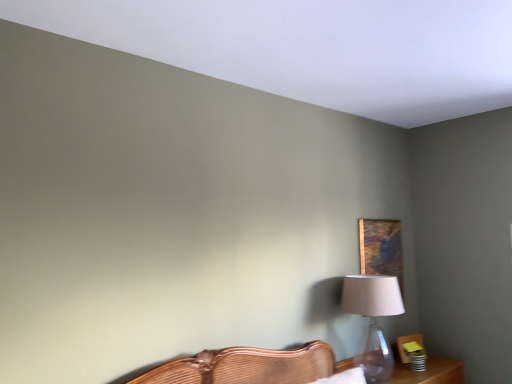
Question: Considering the relative positions of wooden table at lower right and translucent glass table lamp at right in the image provided, is wooden table at lower right to the right of translucent glass table lamp at right from the viewer's perspective?

Choices:
 (A) yes
 (B) no

Answer: (A)

Question: Is translucent glass table lamp at right at the back of wooden table at lower right?

Choices:
 (A) yes
 (B) no

Answer: (B)

Question: Is wooden table at lower right shorter than translucent glass table lamp at right?

Choices:
 (A) yes
 (B) no

Answer: (A)

Question: Is wooden table at lower right far away from translucent glass table lamp at right?

Choices:
 (A) yes
 (B) no

Answer: (B)

Question: Is wooden table at lower right beside translucent glass table lamp at right?

Choices:
 (A) no
 (B) yes

Answer: (A)

Question: Considering the relative sizes of wooden table at lower right and translucent glass table lamp at right in the image provided, is wooden table at lower right wider than translucent glass table lamp at right?

Choices:
 (A) no
 (B) yes

Answer: (B)

Question: Is wooden table at lower right inside translucent glass table lamp at right?

Choices:
 (A) yes
 (B) no

Answer: (B)

Question: Is the surface of translucent glass table lamp at right in direct contact with wooden table at lower right?

Choices:
 (A) yes
 (B) no

Answer: (B)

Question: Considering the relative sizes of translucent glass table lamp at right and wooden table at lower right in the image provided, is translucent glass table lamp at right wider than wooden table at lower right?

Choices:
 (A) yes
 (B) no

Answer: (B)

Question: From a real-world perspective, is translucent glass table lamp at right positioned over wooden table at lower right based on gravity?

Choices:
 (A) no
 (B) yes

Answer: (B)

Question: Considering the relative positions of translucent glass table lamp at right and wooden table at lower right in the image provided, is translucent glass table lamp at right behind wooden table at lower right?

Choices:
 (A) yes
 (B) no

Answer: (B)

Question: Is translucent glass table lamp at right looking in the opposite direction of wooden table at lower right?

Choices:
 (A) yes
 (B) no

Answer: (B)

Question: From a real-world perspective, is wooden table at lower right positioned over wooden painting at upper right based on gravity?

Choices:
 (A) yes
 (B) no

Answer: (B)